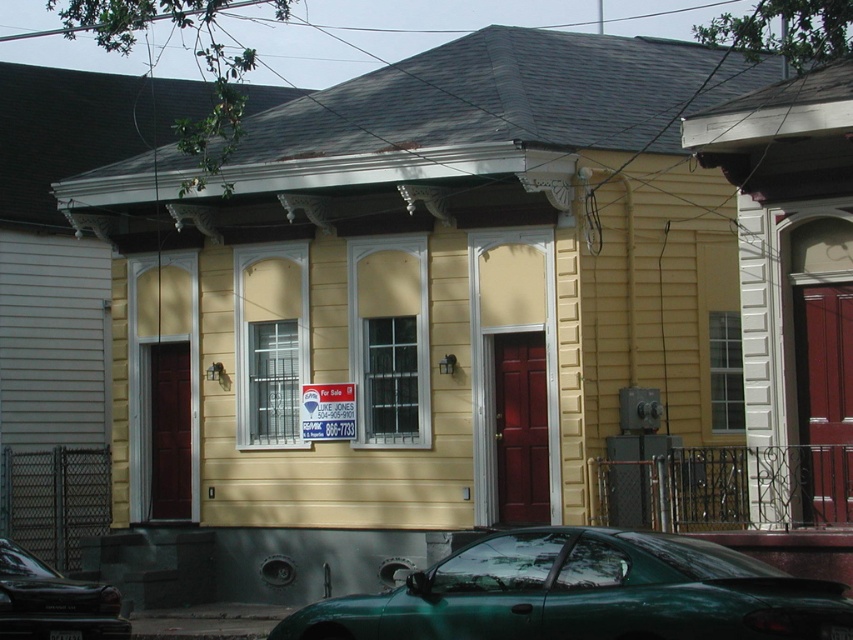
Question: Can you confirm if green matte car at lower center is thinner than red plastic sign at center?

Choices:
 (A) no
 (B) yes

Answer: (A)

Question: Among these objects, which one is farthest from the camera?

Choices:
 (A) green matte car at lower center
 (B) red plastic sign at center
 (C) metallic green car at lower center

Answer: (B)

Question: Is metallic green car at lower center wider than red plastic sign at center?

Choices:
 (A) no
 (B) yes

Answer: (B)

Question: Is green matte car at lower center below red plastic sign at center?

Choices:
 (A) no
 (B) yes

Answer: (B)

Question: Which point appears closest to the camera in this image?

Choices:
 (A) (30, 588)
 (B) (323, 404)
 (C) (631, 636)

Answer: (C)

Question: Which object is farther from the camera taking this photo?

Choices:
 (A) green matte car at lower center
 (B) red plastic sign at center
 (C) metallic green car at lower center

Answer: (B)